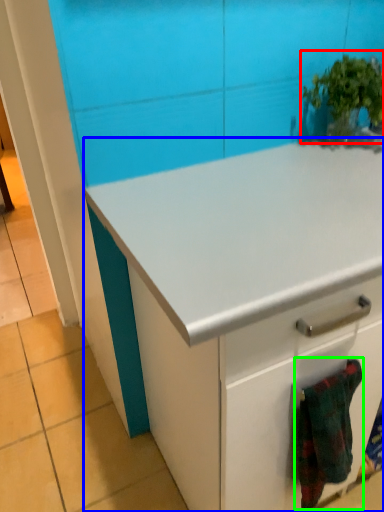
Question: Which object is positioned farthest from houseplant (highlighted by a red box)? Select from cabinetry (highlighted by a blue box) and blanket (highlighted by a green box).

Choices:
 (A) cabinetry
 (B) blanket

Answer: (B)